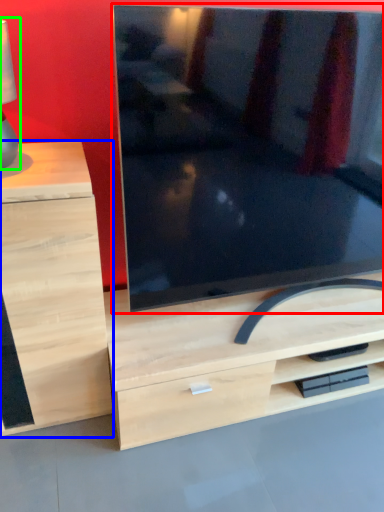
Question: Based on their relative distances, which object is nearer to television (highlighted by a red box)? Choose from chest of drawers (highlighted by a blue box) and table lamp (highlighted by a green box).

Choices:
 (A) chest of drawers
 (B) table lamp

Answer: (A)